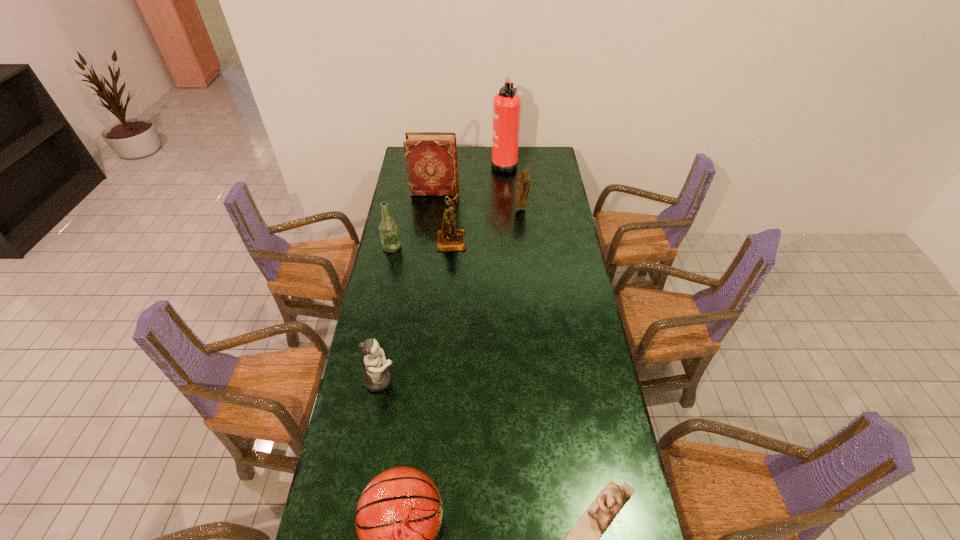
Where is `vacant area that lies between the farthest figurine and the leftmost figurine`? Image resolution: width=960 pixels, height=540 pixels. vacant area that lies between the farthest figurine and the leftmost figurine is located at coordinates (450, 294).

The image size is (960, 540). Find the location of `object that stands as the third closest to the tallest object`. object that stands as the third closest to the tallest object is located at coordinates (449, 238).

Where is `object that is the second closest to the second farthest object`? This screenshot has height=540, width=960. object that is the second closest to the second farthest object is located at coordinates (449, 238).

This screenshot has height=540, width=960. Find the location of `figurine object that ranks as the third closest to the second figurine from left to right`. figurine object that ranks as the third closest to the second figurine from left to right is located at coordinates (583, 539).

This screenshot has width=960, height=540. Find the location of `figurine that is the third nearest to the third nearest figurine`. figurine that is the third nearest to the third nearest figurine is located at coordinates (583, 539).

The image size is (960, 540). Find the location of `free space in the image that satisfies the following two spatial constraints: 1. on the front-facing side of the farthest figurine; 2. on the front-facing side of the second nearest figurine`. free space in the image that satisfies the following two spatial constraints: 1. on the front-facing side of the farthest figurine; 2. on the front-facing side of the second nearest figurine is located at coordinates (540, 380).

Locate an element on the screen. free space in the image that satisfies the following two spatial constraints: 1. on the front-facing side of the farthest figurine; 2. on the front-facing side of the second nearest figurine is located at coordinates (540, 380).

Identify the location of free region that satisfies the following two spatial constraints: 1. on the front-facing side of the third farthest object; 2. on the front-facing side of the second farthest figurine. The image size is (960, 540). (524, 240).